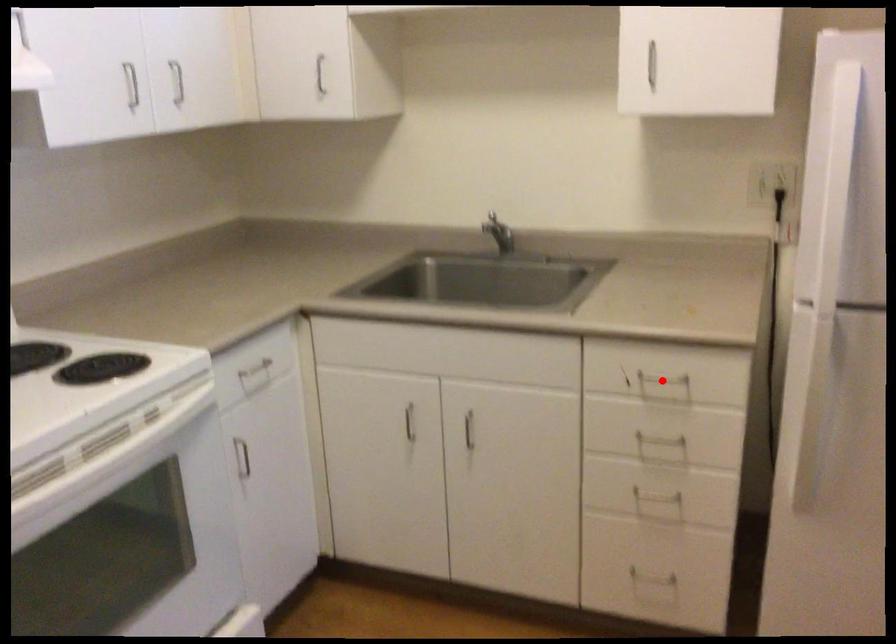
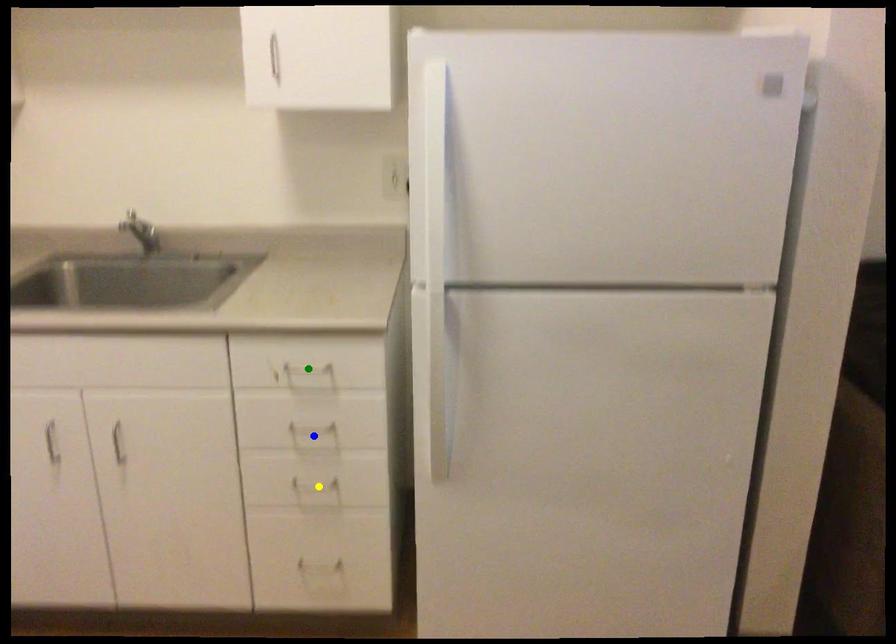
Question: I am providing you with two images of the same scene from different viewpoints. A red point is marked on the first image. You are given multiple points on the second image. Which spot in image 2 lines up with the point in image 1?

Choices:
 (A) green point
 (B) blue point
 (C) yellow point

Answer: (A)